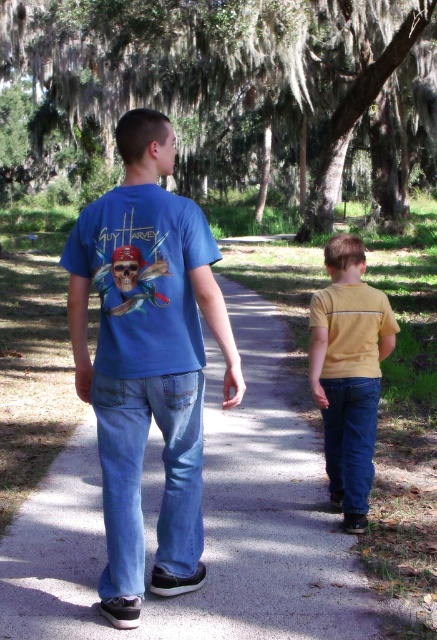
Consider the image. You are planning to walk along the smooth concrete path at center and denim at right. Which path should you choose if you want to walk on the smaller one?

The smooth concrete path at center has a smaller size compared to denim at right, so you should choose the smooth concrete path at center.